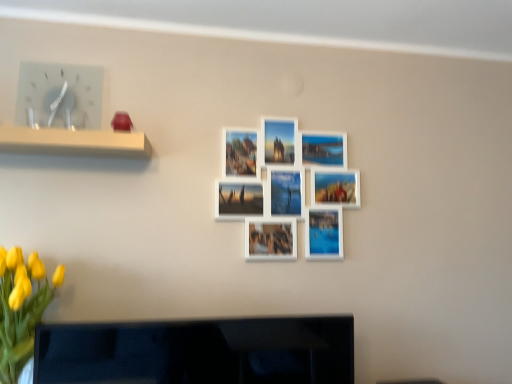
Question: Is white plastic clock at upper left wider than black glossy tv at lower center?

Choices:
 (A) yes
 (B) no

Answer: (B)

Question: Is white plastic clock at upper left at the right side of black glossy tv at lower center?

Choices:
 (A) no
 (B) yes

Answer: (A)

Question: From the image's perspective, is white plastic clock at upper left located beneath black glossy tv at lower center?

Choices:
 (A) yes
 (B) no

Answer: (B)

Question: Can you confirm if white plastic clock at upper left is bigger than black glossy tv at lower center?

Choices:
 (A) yes
 (B) no

Answer: (B)

Question: Does white plastic clock at upper left have a smaller size compared to black glossy tv at lower center?

Choices:
 (A) yes
 (B) no

Answer: (A)

Question: Considering their positions, is yellow matte flowers at lower left located in front of or behind white plastic clock at upper left?

Choices:
 (A) behind
 (B) front

Answer: (B)

Question: Is point (17, 340) positioned closer to the camera than point (80, 114)?

Choices:
 (A) farther
 (B) closer

Answer: (B)

Question: Looking at their shapes, would you say yellow matte flowers at lower left is wider or thinner than white plastic clock at upper left?

Choices:
 (A) thin
 (B) wide

Answer: (B)

Question: Is yellow matte flowers at lower left bigger or smaller than white plastic clock at upper left?

Choices:
 (A) big
 (B) small

Answer: (A)

Question: Relative to yellow matte flowers at lower left, is black glossy tv at lower center in front or behind?

Choices:
 (A) behind
 (B) front

Answer: (A)

Question: From the image's perspective, is black glossy tv at lower center located above or below yellow matte flowers at lower left?

Choices:
 (A) below
 (B) above

Answer: (A)

Question: Is black glossy tv at lower center situated inside yellow matte flowers at lower left or outside?

Choices:
 (A) inside
 (B) outside

Answer: (B)

Question: In terms of size, does black glossy tv at lower center appear bigger or smaller than yellow matte flowers at lower left?

Choices:
 (A) big
 (B) small

Answer: (B)

Question: Relative to yellow matte flowers at lower left, is white plastic clock at upper left in front or behind?

Choices:
 (A) front
 (B) behind

Answer: (B)

Question: Is point (86, 94) positioned closer to the camera than point (6, 317)?

Choices:
 (A) closer
 (B) farther

Answer: (B)